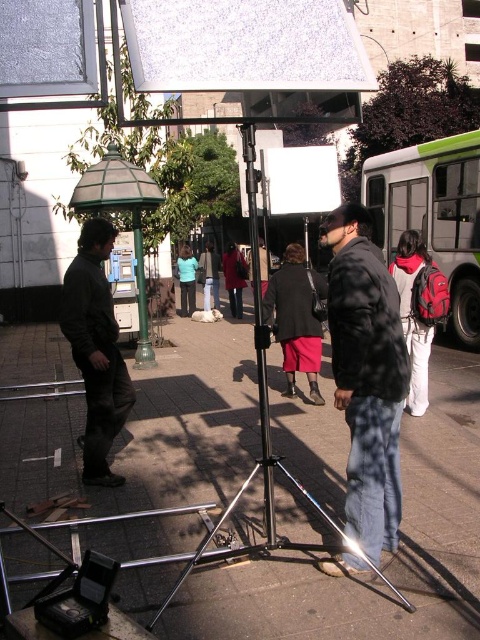
You are a photographer setting up equipment. You need to place a 1.5 meter tall reflector between the dark green jacket at left and the white plastic tripod at center. Can you fit it vertically between them?

The dark green jacket at left is taller than the white plastic tripod at center, but the height difference alone doesn not determine the vertical space between them. The question requires knowing the distance between the two objects, which isn provided in the Objects Description. Therefore, it is impossible to determine if the 1.5 meter tall reflector can fit vertically between them based on the given information.

You are standing at the point labeled point (259, 406) in the image. What object is directly beneath your feet?

The point labeled point (259, 406) is located on the white plastic tripod at center, so the object directly beneath your feet is the white plastic tripod at center.